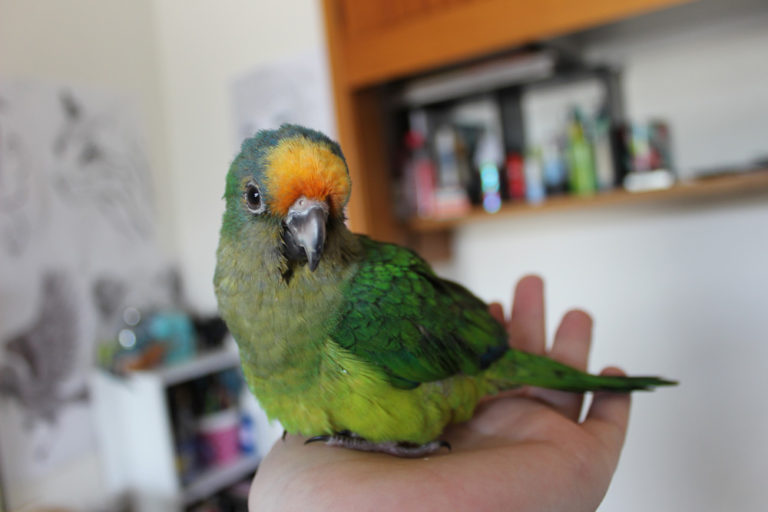
Find the location of a particular element. The height and width of the screenshot is (512, 768). wall is located at coordinates (194, 20), (696, 283).